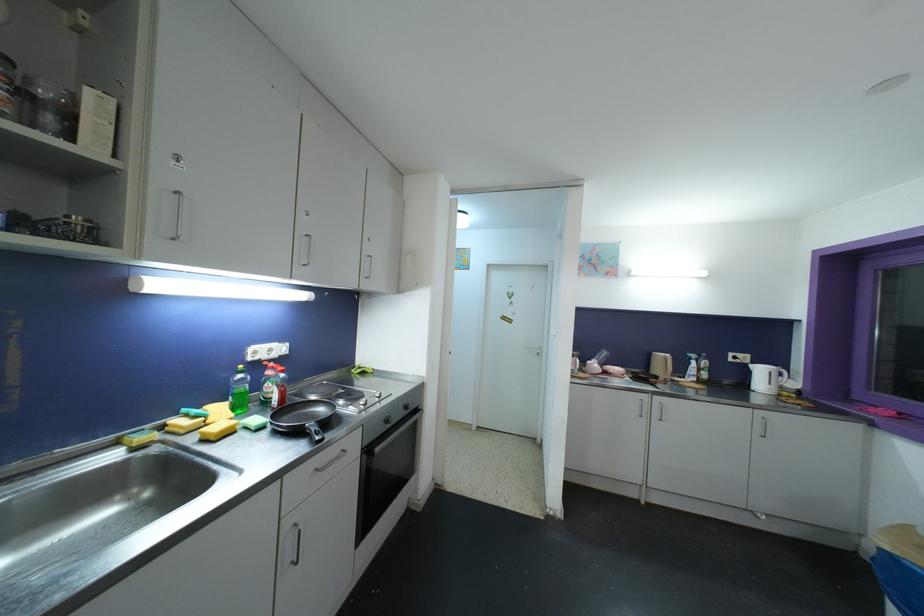
Describe the element at coordinates (531, 365) in the screenshot. The width and height of the screenshot is (924, 616). I see `the white door handle` at that location.